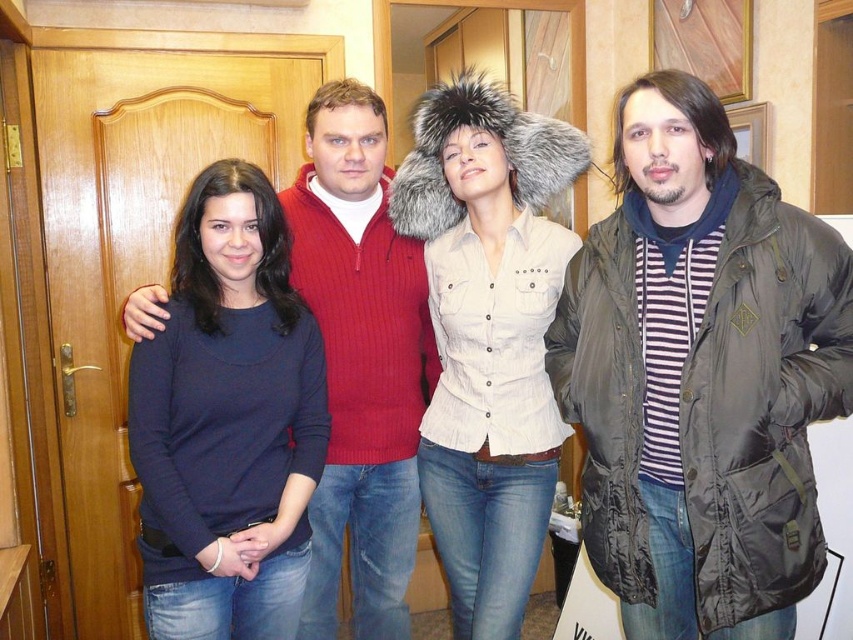
You are trying to see the framed picture on the right side of the wall. There are two people in front of you wearing a dark blue sweater at center and a white cotton shirt at center. Which one should you move to get a better view?

You should move the dark blue sweater at center because it is in front of the white cotton shirt at center, making it closer to you and blocking the view.